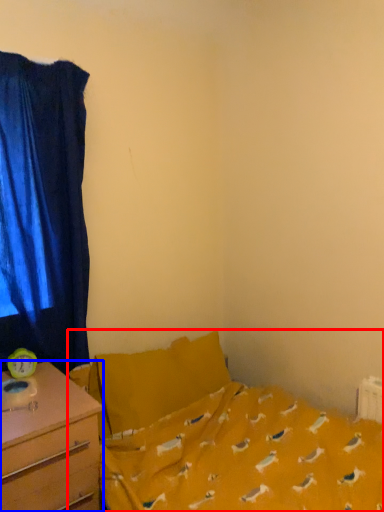
Question: Which object is closer to the camera taking this photo, bed (highlighted by a red box) or desk (highlighted by a blue box)?

Choices:
 (A) bed
 (B) desk

Answer: (B)